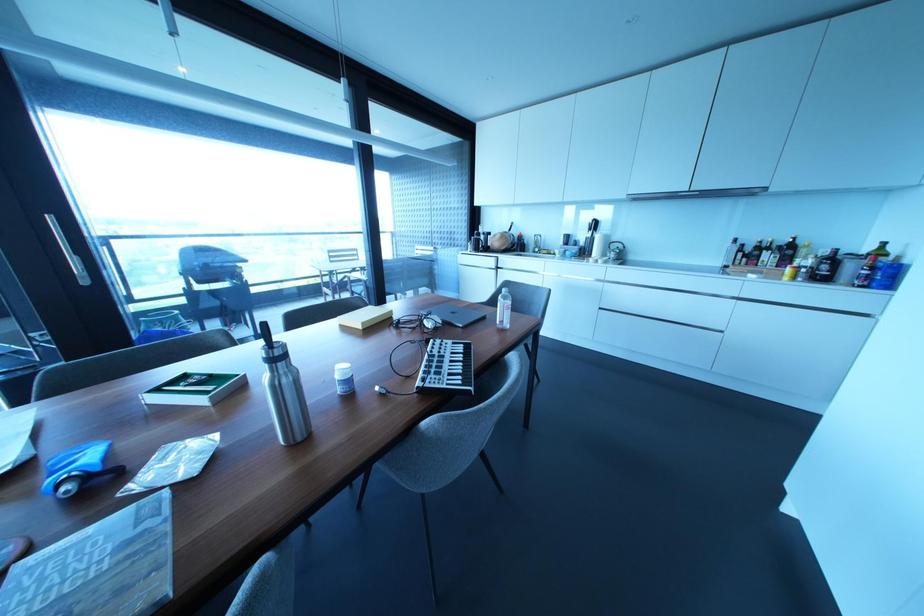
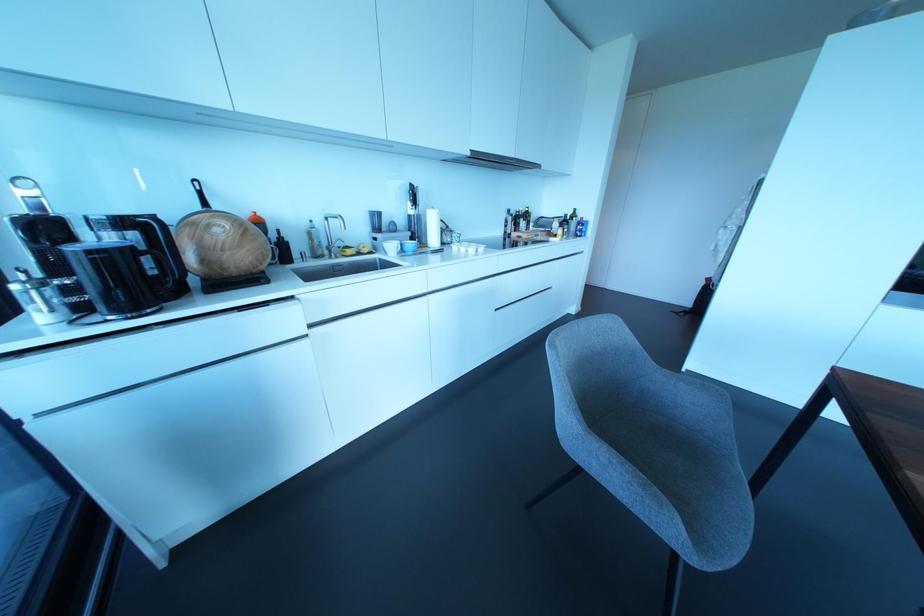
In the second image, find the point that corresponds to point (564, 251) in the first image.

(400, 244)